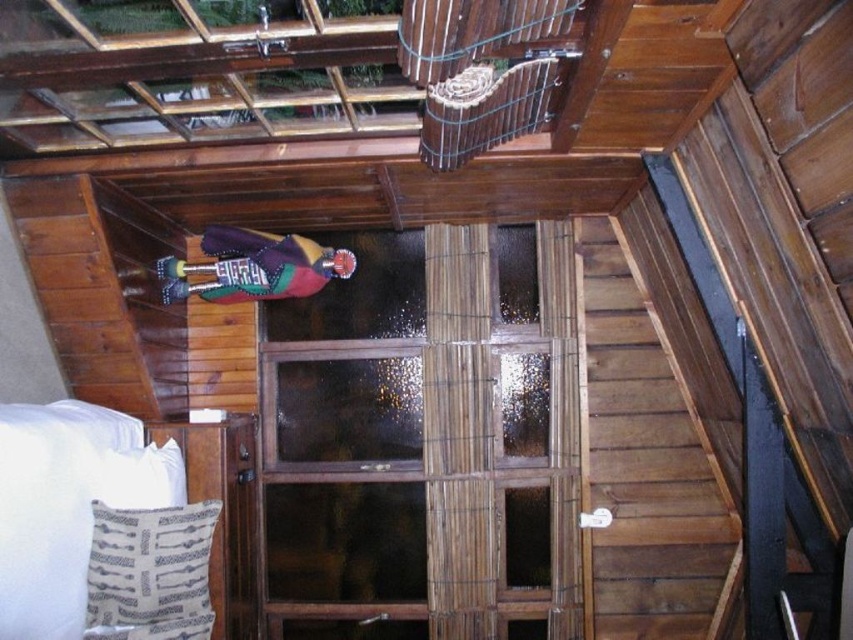
Question: Does wooden birdcage at upper center come in front of patterned fabric pillow at lower left?

Choices:
 (A) no
 (B) yes

Answer: (B)

Question: Is white soft bed at lower left smaller than white fabric pillow at lower left?

Choices:
 (A) yes
 (B) no

Answer: (B)

Question: Which object is positioned closest to the white soft bed at lower left?

Choices:
 (A) patterned fabric pillow at lower left
 (B) wooden birdcage at upper center

Answer: (A)

Question: Is white soft bed at lower left further to camera compared to wooden birdcage at upper center?

Choices:
 (A) no
 (B) yes

Answer: (B)

Question: Which point appears closest to the camera in this image?

Choices:
 (A) (135, 484)
 (B) (54, 534)
 (C) (126, 634)
 (D) (430, 154)

Answer: (B)

Question: Which of the following is the closest to the observer?

Choices:
 (A) (517, 38)
 (B) (138, 596)
 (C) (90, 429)
 (D) (137, 461)

Answer: (A)